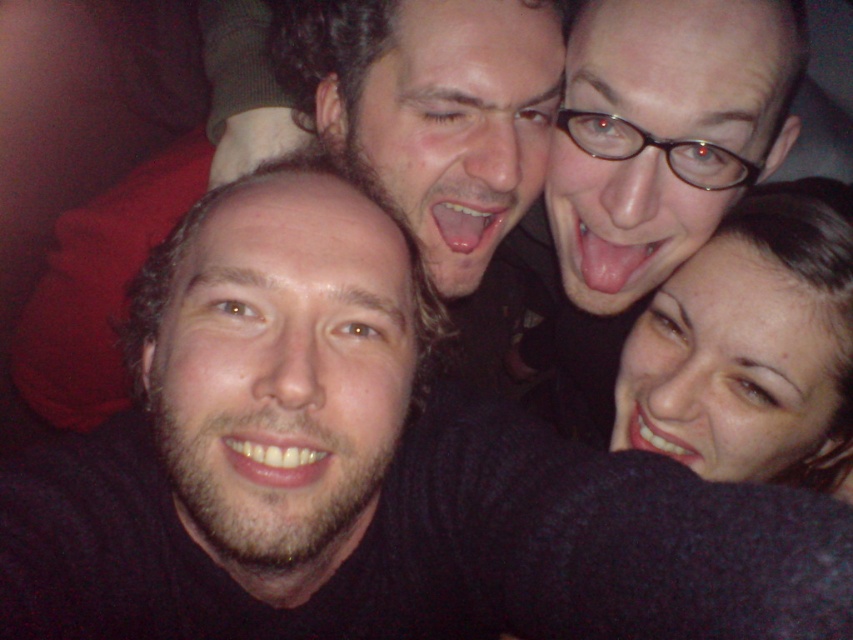
Question: Which point is farther to the camera?

Choices:
 (A) white glossy teeth at lower right
 (B) smooth skin face at lower right

Answer: (A)

Question: Among these objects, which one is nearest to the camera?

Choices:
 (A) pink flesh at center
 (B) smooth skin mouth at center
 (C) smooth skin face at lower right

Answer: (B)

Question: Is smooth skin mouth at center further to camera compared to glossy white teeth at center?

Choices:
 (A) yes
 (B) no

Answer: (B)

Question: Does smooth skin face at lower right have a larger size compared to white glossy teeth at lower right?

Choices:
 (A) no
 (B) yes

Answer: (B)

Question: Which point is farther from the camera taking this photo?

Choices:
 (A) (633, 404)
 (B) (634, 257)
 (C) (476, 243)
 (D) (724, 298)

Answer: (A)

Question: Can you confirm if glossy white teeth at center is positioned to the left of pink flesh at center?

Choices:
 (A) no
 (B) yes

Answer: (B)